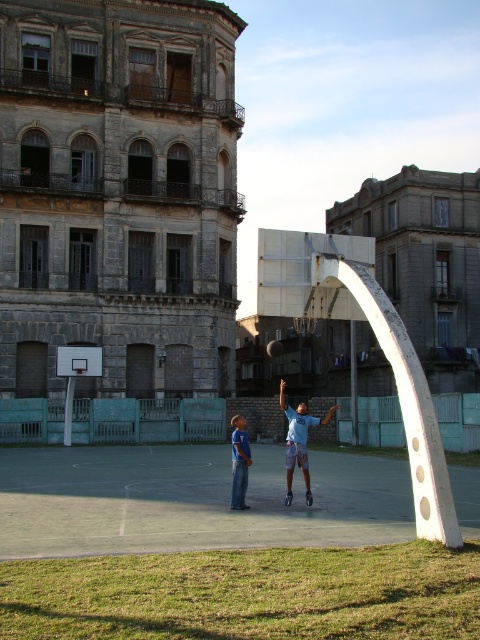
Does smooth concrete court at center have a smaller size compared to white glossy basketball hoop at left?

No, smooth concrete court at center is not smaller than white glossy basketball hoop at left.

Can you confirm if smooth concrete court at center is thinner than white glossy basketball hoop at left?

No, smooth concrete court at center is not thinner than white glossy basketball hoop at left.

What are the coordinates of `smooth concrete court at center` in the screenshot? It's located at (191, 500).

Where is `smooth concrete court at center`? The image size is (480, 640). smooth concrete court at center is located at coordinates (191, 500).

Which is more to the left, light blue jersey at center or white glossy basketball hoop at left?

From the viewer's perspective, white glossy basketball hoop at left appears more on the left side.

At what (x,y) coordinates should I click in order to perform the action: click on light blue jersey at center. Please return your answer as a coordinate pair (x, y). Looking at the image, I should click on (299, 442).

Can you confirm if smooth concrete court at center is positioned below light blue jersey at center?

No, smooth concrete court at center is not below light blue jersey at center.

Does smooth concrete court at center have a smaller size compared to light blue jersey at center?

Indeed, smooth concrete court at center has a smaller size compared to light blue jersey at center.

Describe the element at coordinates (191, 500) in the screenshot. I see `smooth concrete court at center` at that location.

Where is `smooth concrete court at center`? The image size is (480, 640). smooth concrete court at center is located at coordinates (191, 500).